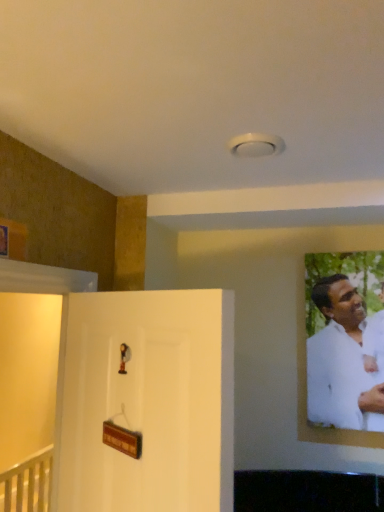
Question: Is white matte door at left bigger or smaller than white matte shirt at right?

Choices:
 (A) small
 (B) big

Answer: (B)

Question: Is point coord(195,349) positioned closer to the camera than point coord(354,379)?

Choices:
 (A) farther
 (B) closer

Answer: (B)

Question: From a real-world perspective, is white matte door at left above or below white matte shirt at right?

Choices:
 (A) above
 (B) below

Answer: (B)

Question: Is point (307, 339) positioned closer to the camera than point (74, 438)?

Choices:
 (A) farther
 (B) closer

Answer: (A)

Question: From their relative heights in the image, would you say white matte shirt at right is taller or shorter than white matte door at left?

Choices:
 (A) tall
 (B) short

Answer: (B)

Question: Considering their positions, is white matte shirt at right located in front of or behind white matte door at left?

Choices:
 (A) behind
 (B) front

Answer: (A)

Question: Considering the relative positions of white matte shirt at right and white matte door at left in the image provided, is white matte shirt at right to the left or to the right of white matte door at left?

Choices:
 (A) right
 (B) left

Answer: (A)